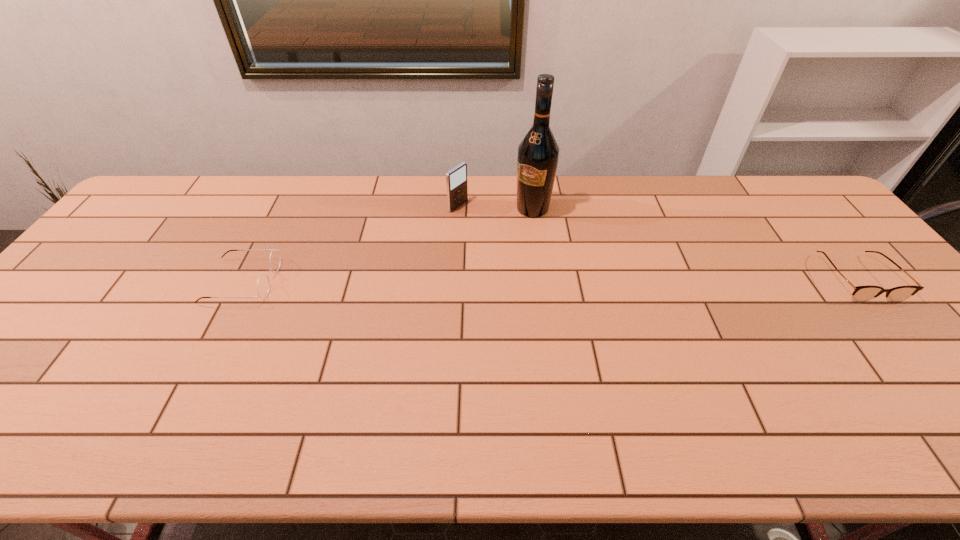
You are a GUI agent. You are given a task and a screenshot of the screen. Output one action in this format:
    pyautogui.click(x=<x>, y=<y>)
    Task: Click on the vacant region between the left spectacles and the tallest object
    
    Given the screenshot: What is the action you would take?
    pyautogui.click(x=388, y=245)

You are a GUI agent. You are given a task and a screenshot of the screen. Output one action in this format:
    pyautogui.click(x=<x>, y=<y>)
    Task: Click on the free space between the right spectacles and the third shortest object
    
    Given the screenshot: What is the action you would take?
    pyautogui.click(x=657, y=242)

At what (x,y) coordinates should I click in order to perform the action: click on object that is the closest to the second object from right to left. Please return your answer as a coordinate pair (x, y). Looking at the image, I should click on (456, 179).

Identify the location of object that is the closest to the rightmost object. (537, 160).

In order to click on vacant space that satisfies the following two spatial constraints: 1. on the front side of the third shortest object; 2. on the left side of the tallest object in this screenshot , I will do `click(458, 208)`.